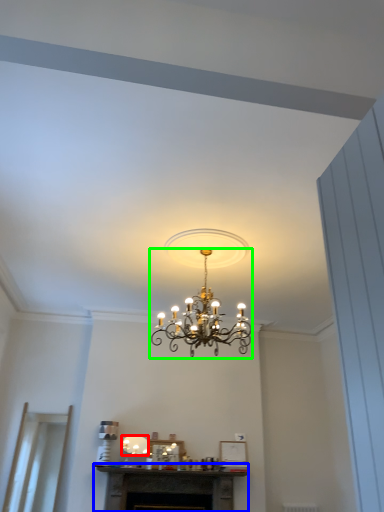
Question: Which is nearer to the lamp (highlighted by a red box)? fireplace (highlighted by a blue box) or lamp (highlighted by a green box).

Choices:
 (A) fireplace
 (B) lamp

Answer: (A)